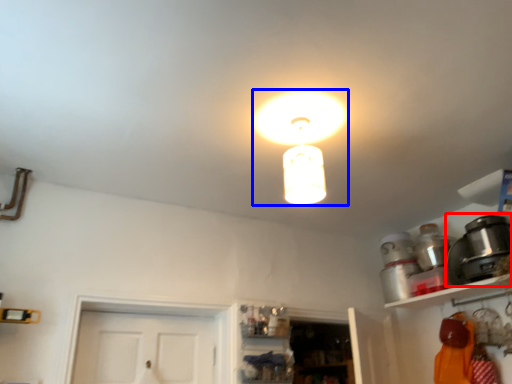
Question: Which point is closer to the camera, appliance (highlighted by a red box) or lamp (highlighted by a blue box)?

Choices:
 (A) appliance
 (B) lamp

Answer: (B)